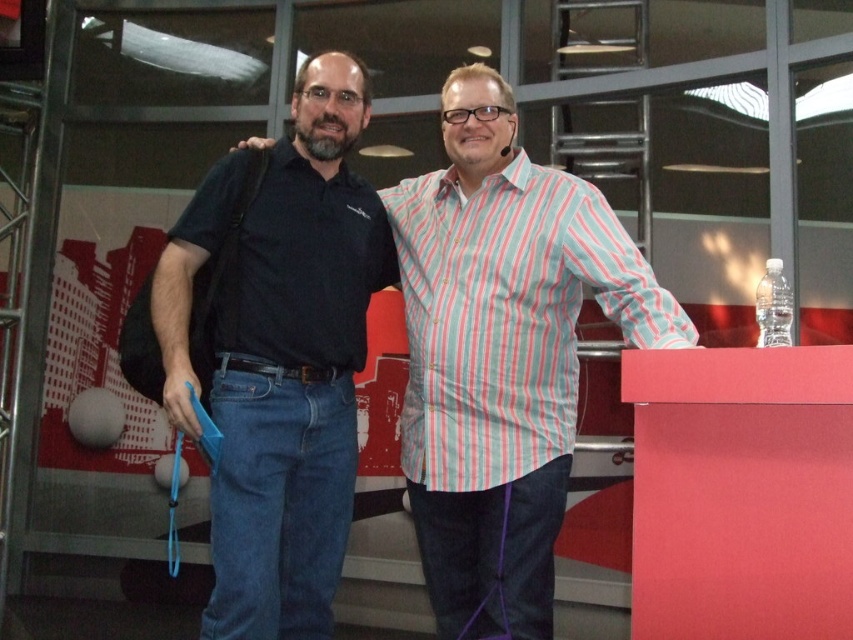
Question: Is matte black shirt at center thinner than black matte shirt at center?

Choices:
 (A) yes
 (B) no

Answer: (B)

Question: Which object is farther from the camera taking this photo?

Choices:
 (A) matte black shirt at center
 (B) black matte shirt at center

Answer: (B)

Question: Which point is closer to the camera taking this photo?

Choices:
 (A) (451, 628)
 (B) (286, 413)

Answer: (B)

Question: Can you confirm if matte black shirt at center is positioned to the left of black matte shirt at center?

Choices:
 (A) no
 (B) yes

Answer: (A)

Question: Is matte black shirt at center positioned at the back of black matte shirt at center?

Choices:
 (A) no
 (B) yes

Answer: (A)